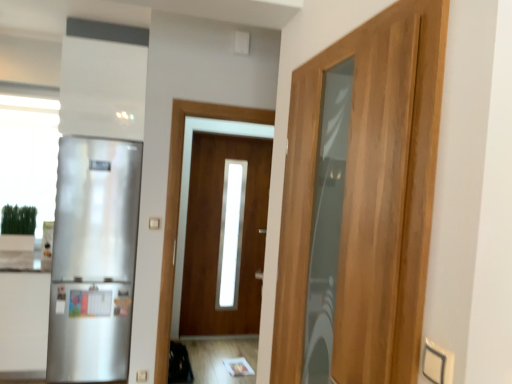
In order to face satin white cabinet at left, should I rotate leftwards or rightwards?

Turn left by 28.653 degrees to look at satin white cabinet at left.

Locate an element on the screen. wooden door at center, the 1th door positioned from the left is located at coordinates (219, 235).

Where is `satin white cabinet at left`? The width and height of the screenshot is (512, 384). satin white cabinet at left is located at coordinates (24, 324).

From the image's perspective, which one is positioned higher, wooden door at center, the 1th door positioned from the left, or satin white cabinet at left?

wooden door at center, the 1th door positioned from the left, is shown above in the image.

Which is nearer, (205,325) or (4,297)?

The point (4,297) is more forward.

From a real-world perspective, who is located higher, wooden door at center, the second door when ordered from front to back, or satin white cabinet at left?

From a 3D spatial view, wooden door at center, the second door when ordered from front to back, is above.

Which point is more distant from viewer, (102,365) or (180,235)?

Point (180,235)

From a real-world perspective, is satin silver refrigerator at left physically above wooden door at center, the 1th door positioned from the left?

No, from a real-world perspective, satin silver refrigerator at left is not over wooden door at center, the 1th door positioned from the left

Which is more to the left, satin silver refrigerator at left or wooden door at center, which is counted as the first door, starting from the back?

From the viewer's perspective, satin silver refrigerator at left appears more on the left side.

Identify the location of door behind the satin silver refrigerator at left. (219, 235).

The width and height of the screenshot is (512, 384). I want to click on refrigerator behind the wooden door at right, the second door viewed from the left, so point(93,259).

From a real-world perspective, is wooden door at right, which is counted as the second door, starting from the back, over satin silver refrigerator at left?

Yes, from a real-world perspective, wooden door at right, which is counted as the second door, starting from the back, is over satin silver refrigerator at left

Is satin silver refrigerator at left surrounded by wooden door at right, which is the 1th door from right to left?

Definitely not — satin silver refrigerator at left is not inside wooden door at right, which is the 1th door from right to left.

Which of these two, wooden door at right, which is counted as the second door, starting from the back, or satin silver refrigerator at left, stands taller?

satin silver refrigerator at left.

From a real-world perspective, who is located higher, satin white cabinet at left or wooden door at center, the 1th door positioned from the left?

wooden door at center, the 1th door positioned from the left, is physically above.

Can you confirm if satin white cabinet at left is thinner than wooden door at center, the 1th door positioned from the left?

Incorrect, the width of satin white cabinet at left is not less than that of wooden door at center, the 1th door positioned from the left.

Which object is closer to the camera, satin white cabinet at left or wooden door at center, the second door when ordered from front to back?

satin white cabinet at left is closer to the camera.

The height and width of the screenshot is (384, 512). In order to click on cabinetry that appears below the wooden door at center, acting as the second door starting from the right (from a real-world perspective) in this screenshot , I will do `click(24, 324)`.

Considering the sizes of satin silver refrigerator at left and wooden door at right, which is counted as the second door, starting from the back, in the image, is satin silver refrigerator at left taller or shorter than wooden door at right, which is counted as the second door, starting from the back,?

satin silver refrigerator at left is taller than wooden door at right, which is counted as the second door, starting from the back.

From a real-world perspective, is satin silver refrigerator at left below wooden door at right, the second door viewed from the left?

Yes, from a real-world perspective, satin silver refrigerator at left is beneath wooden door at right, the second door viewed from the left.

Which of these two, satin silver refrigerator at left or wooden door at right, the second door viewed from the left, is wider?

Wider between the two is satin silver refrigerator at left.

Is satin silver refrigerator at left directly adjacent to wooden door at right, which is the 1th door from right to left?

No, satin silver refrigerator at left is not next to wooden door at right, which is the 1th door from right to left.

Is point (248, 142) farther from viewer compared to point (341, 358)?

That is True.

Is wooden door at center, which is counted as the first door, starting from the back, wider or thinner than wooden door at right, which is counted as the second door, starting from the back?

Clearly, wooden door at center, which is counted as the first door, starting from the back, has less width compared to wooden door at right, which is counted as the second door, starting from the back.

The width and height of the screenshot is (512, 384). In the image, there is a wooden door at center, which is counted as the first door, starting from the back. In order to click on door above it (from the image's perspective) in this screenshot , I will do `click(368, 197)`.

Is wooden door at center, which is counted as the first door, starting from the back, shorter than wooden door at right, which is the first door from front to back?

In fact, wooden door at center, which is counted as the first door, starting from the back, may be taller than wooden door at right, which is the first door from front to back.

Can you tell me how much satin white cabinet at left and satin silver refrigerator at left differ in facing direction?

The facing directions of satin white cabinet at left and satin silver refrigerator at left are 8.18e-05 degrees apart.

Identify the location of refrigerator above the satin white cabinet at left (from a real-world perspective). This screenshot has width=512, height=384. (93, 259).

Which of these two, satin white cabinet at left or satin silver refrigerator at left, is wider?

satin white cabinet at left.

Which is in front, satin white cabinet at left or satin silver refrigerator at left?

satin white cabinet at left.

At what (x,y) coordinates should I click in order to perform the action: click on cabinetry on the left of wooden door at center, acting as the second door starting from the right. Please return your answer as a coordinate pair (x, y). Looking at the image, I should click on (24, 324).

I want to click on refrigerator below the wooden door at center, the second door when ordered from front to back (from the image's perspective), so click(93, 259).

Based on their spatial positions, is wooden door at right, which is counted as the second door, starting from the back, or satin white cabinet at left closer to satin silver refrigerator at left?

The object closer to satin silver refrigerator at left is satin white cabinet at left.

Based on their spatial positions, is satin white cabinet at left or satin silver refrigerator at left closer to wooden door at right, which is counted as the second door, starting from the back?

satin silver refrigerator at left lies closer to wooden door at right, which is counted as the second door, starting from the back, than the other object.

Considering their positions, is satin silver refrigerator at left positioned closer to wooden door at right, which is counted as the second door, starting from the back, than wooden door at center, which is counted as the first door, starting from the back?

satin silver refrigerator at left is closer to wooden door at right, which is counted as the second door, starting from the back.

Looking at the image, which one is located closer to satin silver refrigerator at left, wooden door at center, which is counted as the first door, starting from the back, or wooden door at right, which is the 1th door from right to left?

wooden door at center, which is counted as the first door, starting from the back, lies closer to satin silver refrigerator at left than the other object.

Looking at the image, which one is located closer to satin white cabinet at left, satin silver refrigerator at left or wooden door at center, the second door when ordered from front to back?

Based on the image, satin silver refrigerator at left appears to be nearer to satin white cabinet at left.

Estimate the real-world distances between objects in this image. Which object is further from wooden door at right, which is the 1th door from right to left, satin silver refrigerator at left or satin white cabinet at left?

satin white cabinet at left lies further to wooden door at right, which is the 1th door from right to left, than the other object.

Based on their spatial positions, is wooden door at right, which is the first door from front to back, or satin white cabinet at left further from wooden door at center, which is counted as the first door, starting from the back?

The object further to wooden door at center, which is counted as the first door, starting from the back, is wooden door at right, which is the first door from front to back.

From the image, which object appears to be nearer to wooden door at right, which is the first door from front to back, wooden door at center, which is counted as the first door, starting from the back, or satin white cabinet at left?

satin white cabinet at left is positioned closer to the anchor wooden door at right, which is the first door from front to back.

Find the location of a particular element. This screenshot has width=512, height=384. cabinetry between wooden door at right, which is the 1th door from right to left, and wooden door at center, which is counted as the first door, starting from the back, from front to back is located at coordinates click(x=24, y=324).

At what (x,y) coordinates should I click in order to perform the action: click on refrigerator between wooden door at right, which is the first door from front to back, and wooden door at center, the 1th door positioned from the left, along the z-axis. Please return your answer as a coordinate pair (x, y). The image size is (512, 384). Looking at the image, I should click on (93, 259).

The image size is (512, 384). Find the location of `refrigerator located between satin white cabinet at left and wooden door at center, which is counted as the first door, starting from the back, in the left-right direction`. refrigerator located between satin white cabinet at left and wooden door at center, which is counted as the first door, starting from the back, in the left-right direction is located at coordinates (93, 259).

Identify the location of cabinetry between wooden door at right, which is the first door from front to back, and satin silver refrigerator at left in the front-back direction. (24, 324).